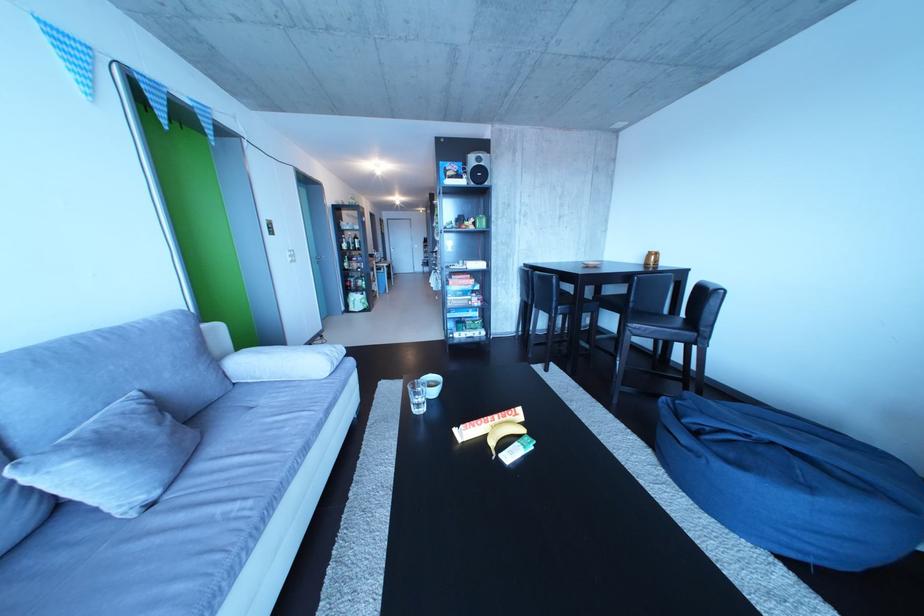
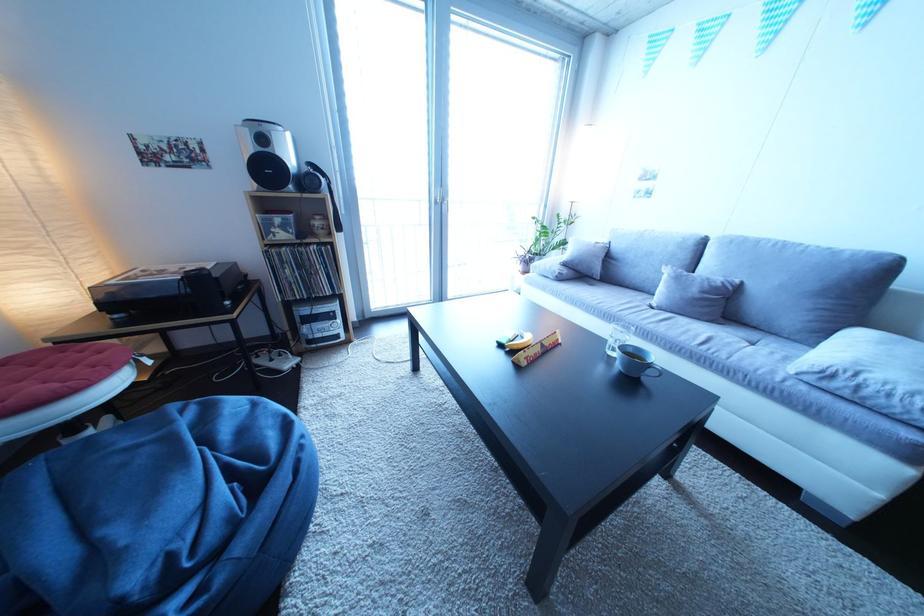
The point at (148, 400) is marked in the first image. Where is the corresponding point in the second image?

(750, 286)